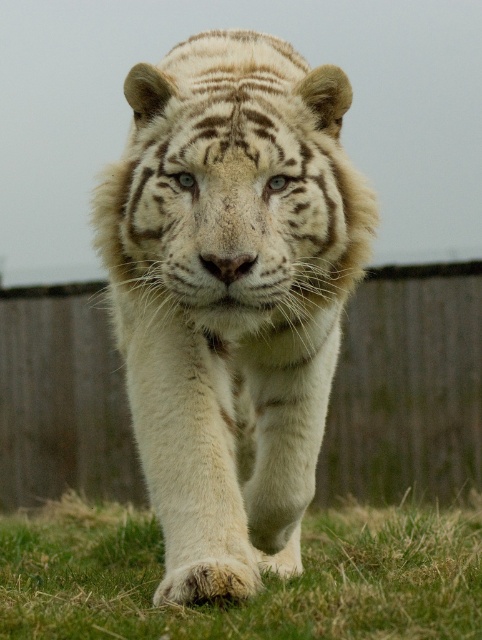
Is white fur tiger at center behind wooden fence at center?

No, it is not.

Does white fur tiger at center appear on the left side of wooden fence at center?

Indeed, white fur tiger at center is positioned on the left side of wooden fence at center.

This screenshot has height=640, width=482. Find the location of `white fur tiger at center`. white fur tiger at center is located at coordinates (230, 294).

Which is above, white fur tiger at center or green grass at lower center?

white fur tiger at center is above.

Does white fur tiger at center have a greater height compared to green grass at lower center?

Yes.

Image resolution: width=482 pixels, height=640 pixels. I want to click on white fur tiger at center, so click(230, 294).

At what (x,y) coordinates should I click in order to perform the action: click on white fur tiger at center. Please return your answer as a coordinate pair (x, y). Image resolution: width=482 pixels, height=640 pixels. Looking at the image, I should click on (230, 294).

Does wooden fence at center appear over green grass at lower center?

Yes, wooden fence at center is above green grass at lower center.

Between wooden fence at center and green grass at lower center, which one appears on the left side from the viewer's perspective?

green grass at lower center

Measure the distance between point (428, 323) and camera.

11.60 meters

Find the location of a particular element. Image resolution: width=482 pixels, height=640 pixels. wooden fence at center is located at coordinates (406, 387).